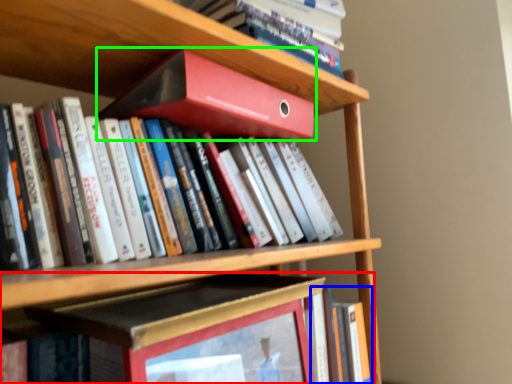
Question: Considering the real-world distances, which object is farthest from book (highlighted by a red box)? book (highlighted by a blue box) or book (highlighted by a green box)?

Choices:
 (A) book
 (B) book

Answer: (B)